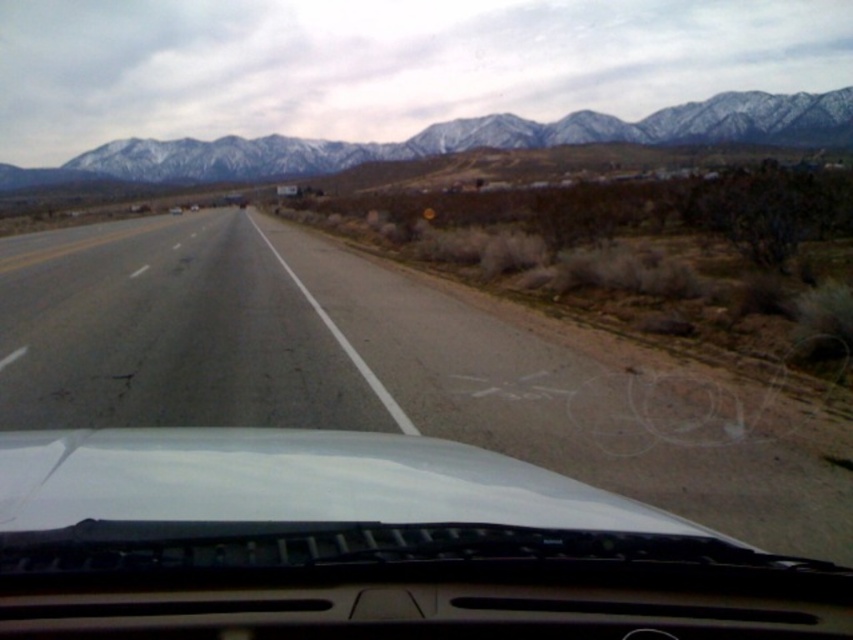
Is white matte windshield at center thinner than snow-covered mountains at upper center?

Correct, white matte windshield at center's width is less than snow-covered mountains at upper center's.

Based on the photo, who is taller, white matte windshield at center or snow-covered mountains at upper center?

snow-covered mountains at upper center

Does point (434, 534) come behind point (776, 106)?

No, it is not.

You are a GUI agent. You are given a task and a screenshot of the screen. Output one action in this format:
    pyautogui.click(x=<x>, y=<y>)
    Task: Click on the white matte windshield at center
    
    Given the screenshot: What is the action you would take?
    pyautogui.click(x=364, y=545)

Who is higher up, asphalt road at center or snow-covered mountains at upper center?

snow-covered mountains at upper center

Who is positioned more to the right, asphalt road at center or snow-covered mountains at upper center?

From the viewer's perspective, snow-covered mountains at upper center appears more on the right side.

Is point (833, 550) positioned in front of point (782, 131)?

Yes, point (833, 550) is in front of point (782, 131).

Find the location of a particular element. The width and height of the screenshot is (853, 640). asphalt road at center is located at coordinates (372, 369).

Does white matte windshield at center come in front of asphalt road at center?

Yes, it is.

Does white matte windshield at center have a larger size compared to asphalt road at center?

No.

Is point (656, 579) positioned before point (154, 296)?

Yes, it is in front of point (154, 296).

At what (x,y) coordinates should I click in order to perform the action: click on white matte windshield at center. Please return your answer as a coordinate pair (x, y). Looking at the image, I should click on (364, 545).